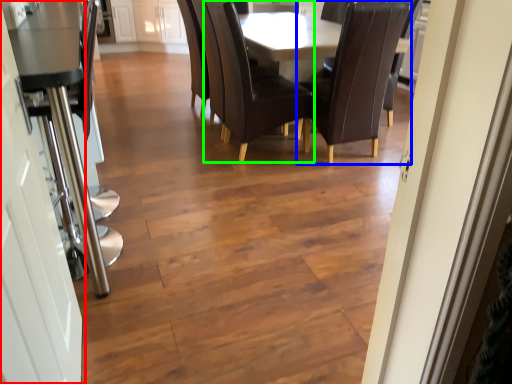
Question: Estimate the real-world distances between objects in this image. Which object is closer to door (highlighted by a red box), chair (highlighted by a blue box) or chair (highlighted by a green box)?

Choices:
 (A) chair
 (B) chair

Answer: (B)